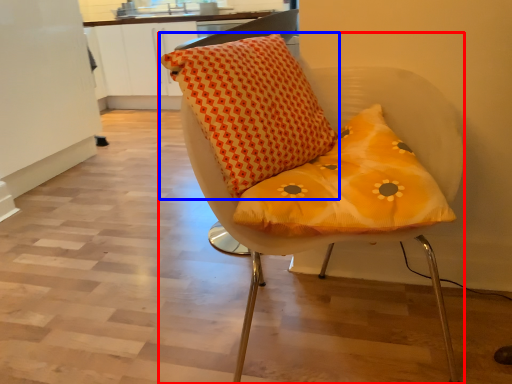
Question: Which point is further to the camera, chair (highlighted by a red box) or pillow (highlighted by a blue box)?

Choices:
 (A) chair
 (B) pillow

Answer: (B)